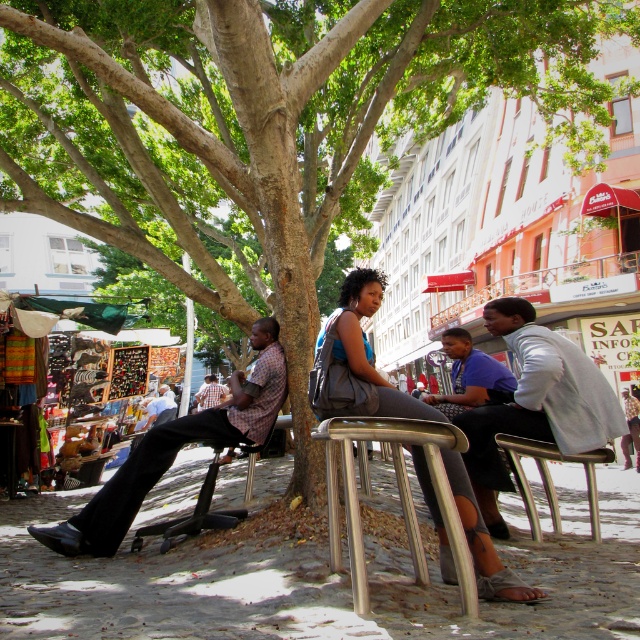
Between point (161, 529) and point (202, 401), which one is positioned in front?

Point (161, 529) is in front.

How much distance is there between metallic silver chair at lower left and checkered shirt at center?

metallic silver chair at lower left and checkered shirt at center are 12.02 meters apart.

Where is `metallic silver chair at lower left`? metallic silver chair at lower left is located at coordinates (204, 500).

Is light gray jacket at center smaller than metallic silver chair at center?

Incorrect, light gray jacket at center is not smaller in size than metallic silver chair at center.

Between point (592, 433) and point (364, 420), which one is positioned behind?

The point (592, 433) is behind.

Locate an element on the screen. This screenshot has width=640, height=640. light gray jacket at center is located at coordinates (536, 403).

At what (x,y) coordinates should I click in order to perform the action: click on light gray jacket at center. Please return your answer as a coordinate pair (x, y). Looking at the image, I should click on [x=536, y=403].

Is point (355, 285) less distant than point (208, 381)?

Yes, it is in front of point (208, 381).

Which is behind, point (372, 275) or point (216, 397)?

Point (216, 397)

Between point (444, 548) and point (204, 401), which one is positioned behind?

The point (204, 401) is more distant.

At what (x,y) coordinates should I click in order to perform the action: click on matte gray tank top at center. Please return your answer as a coordinate pair (x, y). Looking at the image, I should click on (368, 346).